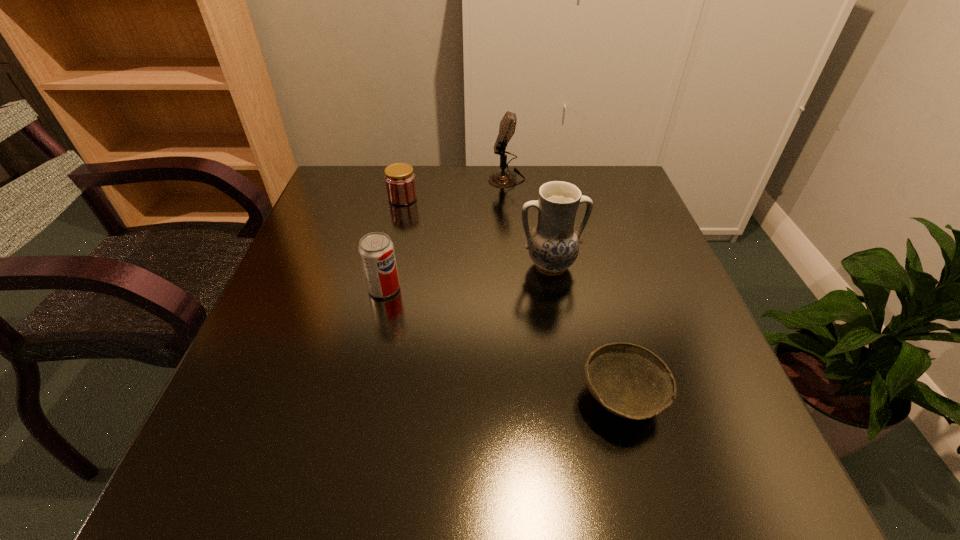
Image resolution: width=960 pixels, height=540 pixels. Find the location of `free spot that satisfies the following two spatial constraints: 1. on the front side of the shortest object; 2. on the right side of the second farthest object`. free spot that satisfies the following two spatial constraints: 1. on the front side of the shortest object; 2. on the right side of the second farthest object is located at coordinates (356, 399).